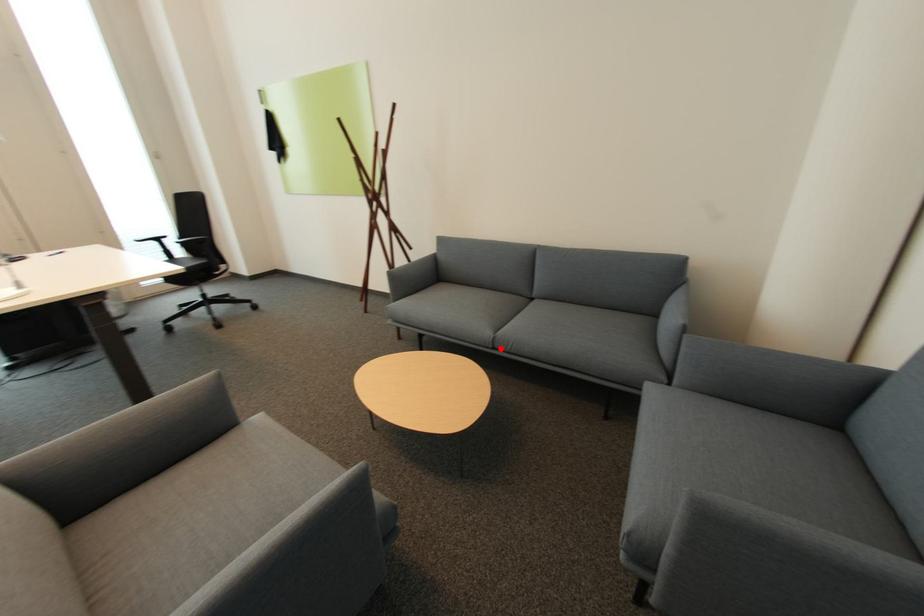
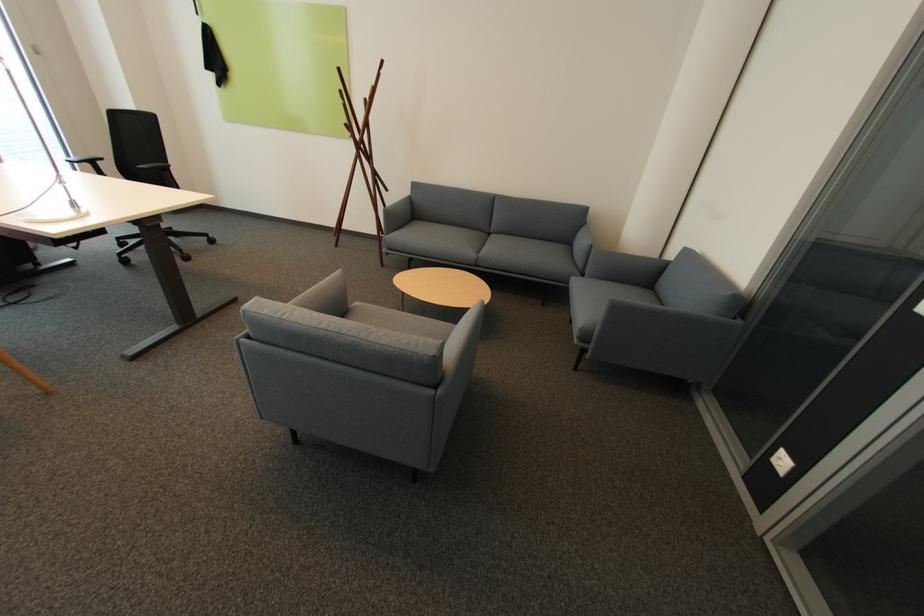
Where in the second image is the point corresponding to the highlighted location from the first image?

(482, 265)